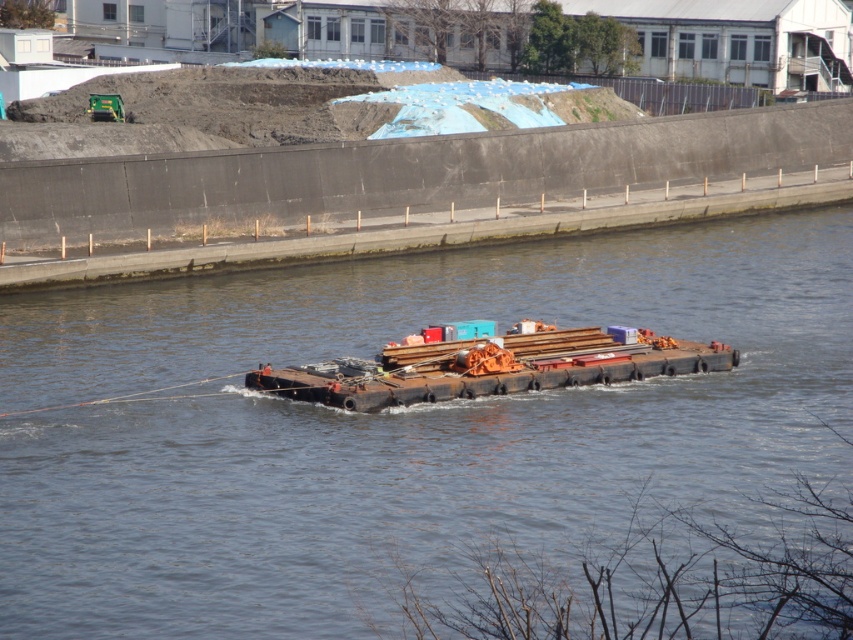
You are a delivery person who needs to place a 3m long wooden plank onto the brown rubber barge at center. The barge is at coordinates point 0.666, 0.462. Can you confirm if the barge is large enough to accommodate the plank?

The brown rubber barge at center is positioned at point (393, 422), but the question about its size cannot be answered with the provided information.

You are a crane operator trying to load cargo onto both the brown rubber barge at center and the rusty metal barge at center. Which barge should you choose if you need to place a tall container that requires more vertical space?

You should choose the brown rubber barge at center because it has a greater height compared to the rusty metal barge at center, providing more vertical space for the tall container.